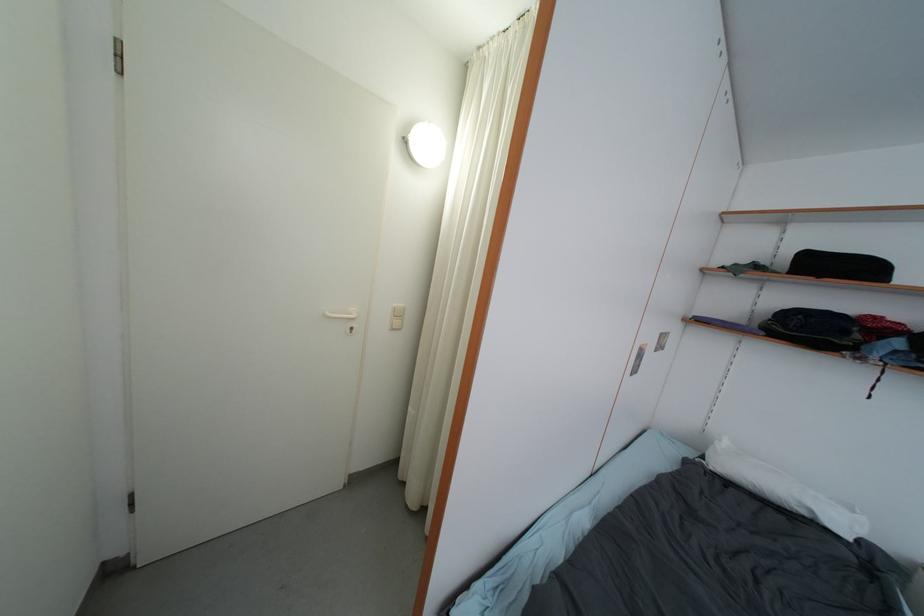
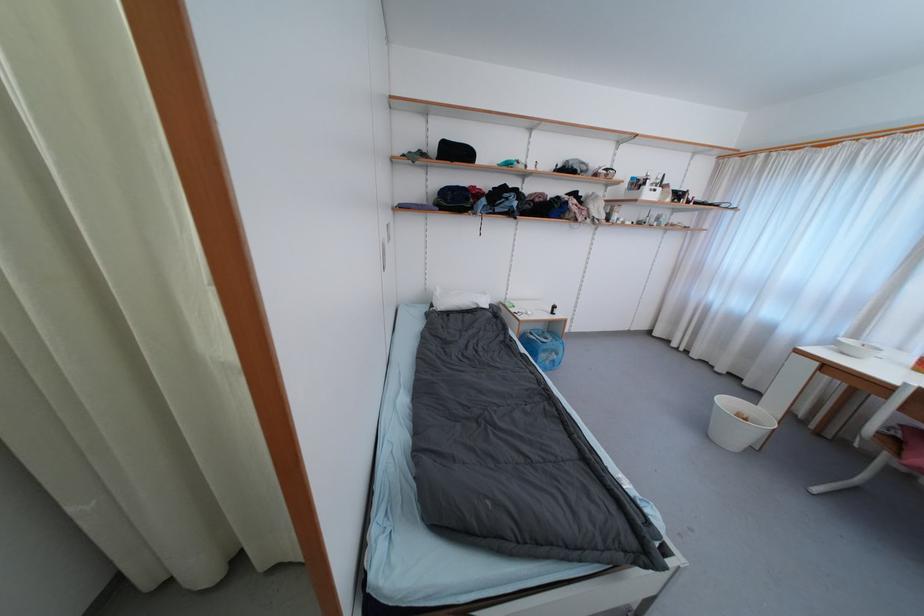
Locate, in the second image, the point that corresponds to [857,514] in the first image.

(489, 296)